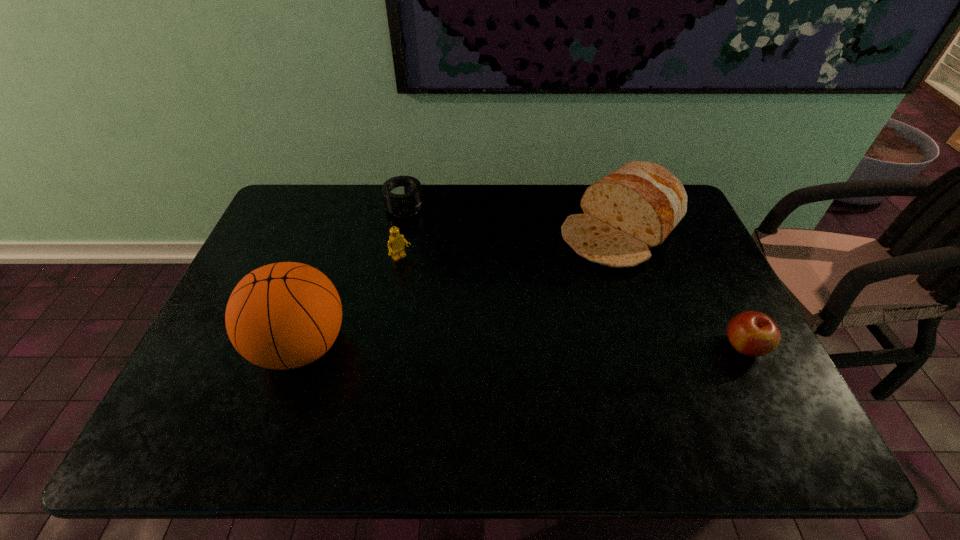
The image size is (960, 540). I want to click on vacant space on the desktop that is between the tallest object and the apple and is positioned on the side of the telephoto lens with brand markings and control switches, so 471,346.

Identify the location of vacant space on the desktop that is between the leftmost object and the apple and is positioned at the sliced end of the fourth shortest object. (488, 346).

Find the location of `free space on the desktop that is between the basketball and the apple and is positioned on the face of the Lego`. free space on the desktop that is between the basketball and the apple and is positioned on the face of the Lego is located at coordinates (489, 346).